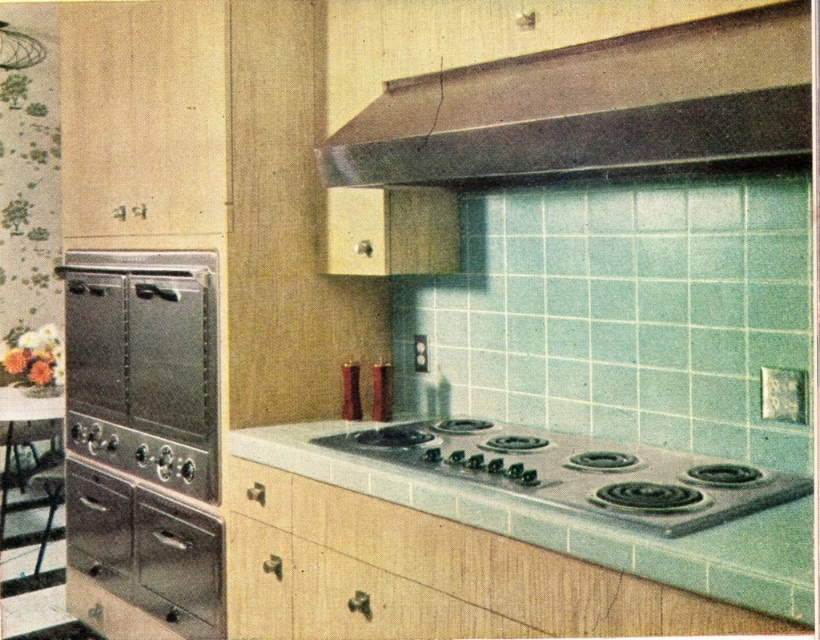
You are a chef preparing to install a new appliance in the kitchen. You have a metallic brown exhaust hood at upper center and a white laminate countertop at center. Which of these two items is the smaller one in size?

The metallic brown exhaust hood at upper center is smaller than the white laminate countertop at center.

Where is the metallic brown exhaust hood at upper center located in the kitchen scene?

The metallic brown exhaust hood at upper center is located at point (591, 106) in the kitchen scene.

You are a home decorator planning to install a new appliance in this kitchen. You have a new appliance that is the same size as the metallic brown exhaust hood at upper center. Can you place it where the stainless steel oven at left is currently located?

The metallic brown exhaust hood at upper center is smaller than the stainless steel oven at left. Since the new appliance is the same size as the exhaust hood, it may not fit in the space currently occupied by the oven, which is larger. Therefore, placing it there might not be feasible due to size differences.